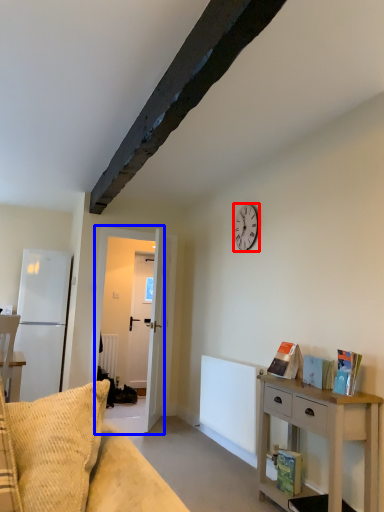
Question: Which point is further to the camera, clock (highlighted by a red box) or door (highlighted by a blue box)?

Choices:
 (A) clock
 (B) door

Answer: (B)